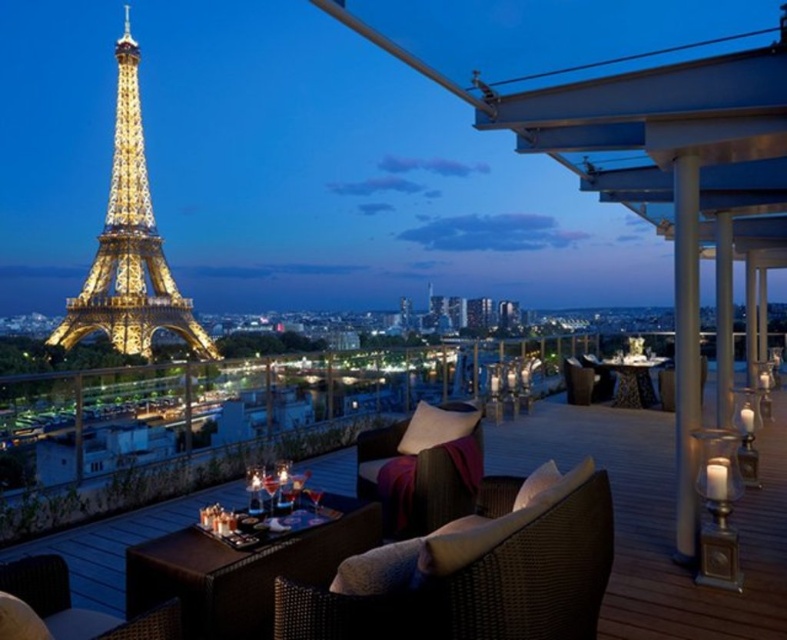
Between point (671, 580) and point (142, 138), which one is positioned behind?

The point (142, 138) is more distant.

Does brown wicker furniture at center have a greater height compared to gold metallic eiffel tower at left?

Incorrect, brown wicker furniture at center's height is not larger of gold metallic eiffel tower at left's.

Is point (497, 435) farther from camera compared to point (91, 301)?

Yes, point (497, 435) is behind point (91, 301).

Where is `brown wicker furniture at center`? The height and width of the screenshot is (640, 787). brown wicker furniture at center is located at coordinates (660, 518).

Who is shorter, gold metallic eiffel tower at left or brown wicker armchair at lower left?

Standing shorter between the two is brown wicker armchair at lower left.

Is point (80, 307) closer to camera compared to point (46, 570)?

No.

The width and height of the screenshot is (787, 640). What do you see at coordinates (128, 244) in the screenshot? I see `gold metallic eiffel tower at left` at bounding box center [128, 244].

In order to click on gold metallic eiffel tower at left in this screenshot , I will do `click(128, 244)`.

Who is more forward, (590, 540) or (464, 499)?

Point (590, 540) is more forward.

Measure the distance between woven brown armchair at center and brown wicker armchair at center.

woven brown armchair at center and brown wicker armchair at center are 29.40 meters apart from each other.

What do you see at coordinates (482, 579) in the screenshot? This screenshot has width=787, height=640. I see `woven brown armchair at center` at bounding box center [482, 579].

Locate an element on the screen. woven brown armchair at center is located at coordinates (482, 579).